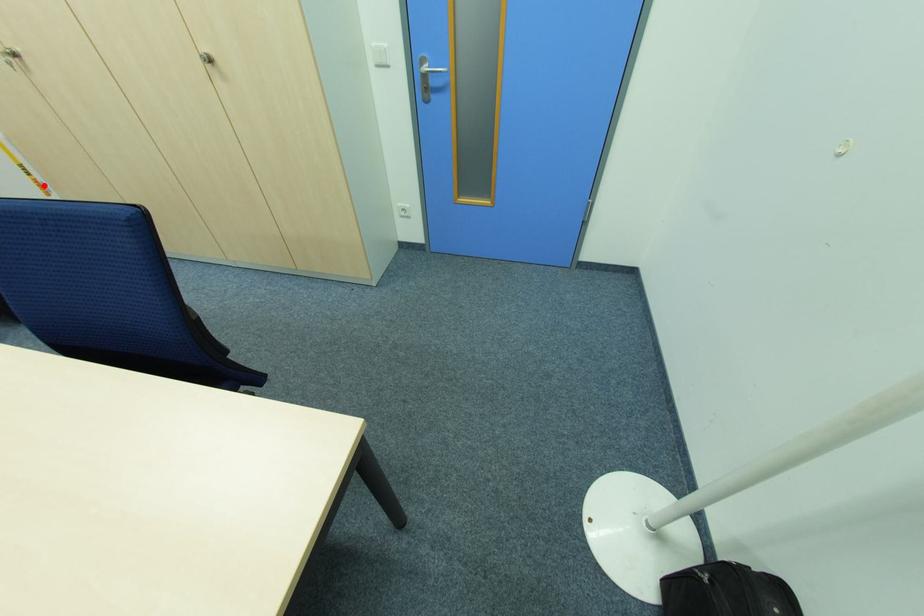
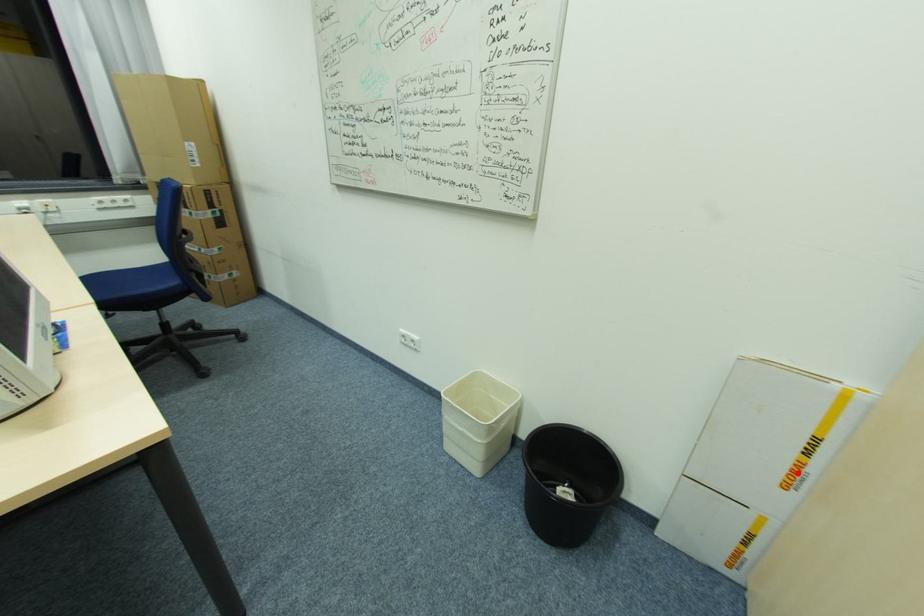
I am providing you with two images of the same scene from different viewpoints. A red point is marked on the first image and another point is marked on the second image. Is the marked point in image1 the same physical position as the marked point in image2?

Yes